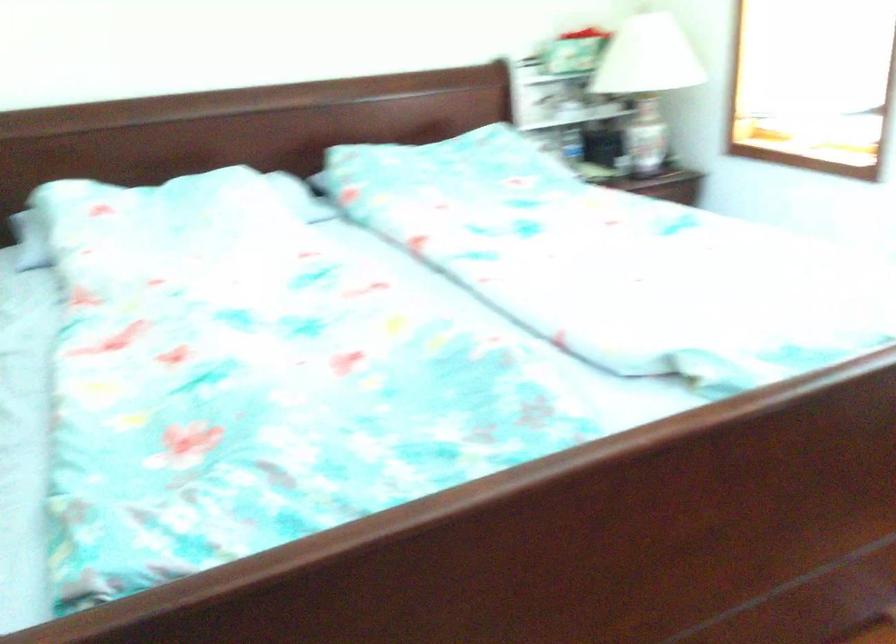
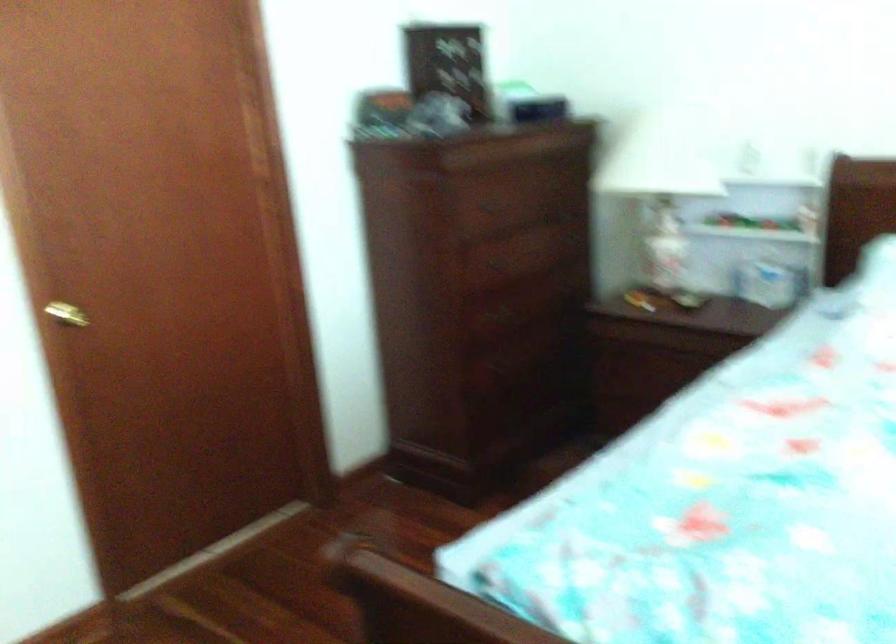
Question: How did the camera likely rotate?

Choices:
 (A) Left
 (B) Right
 (C) Up
 (D) Down

Answer: (A)